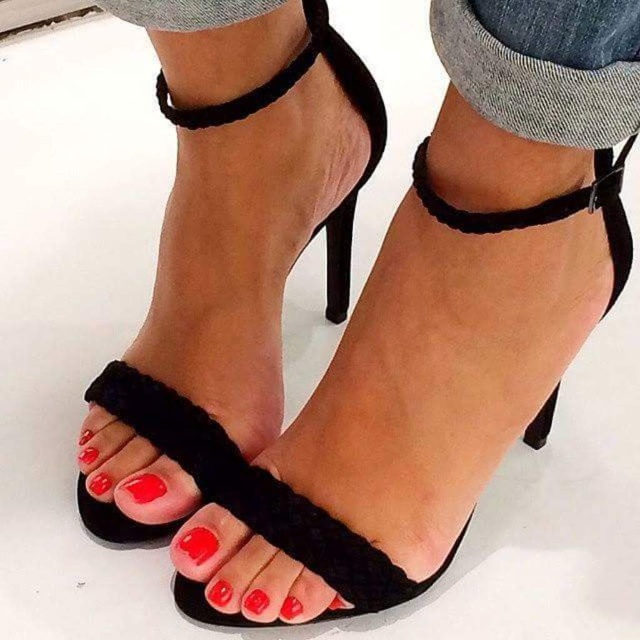
Question: Can you confirm if suede black sandal at center is positioned above matte black toe at center?

Choices:
 (A) no
 (B) yes

Answer: (B)

Question: Based on their relative distances, which object is nearer to the suede black sandal at center?

Choices:
 (A) velvet strap at center
 (B) matte black toe at center
 (C) glossy red nail polish at center

Answer: (C)

Question: Can you confirm if velvet strap at center is positioned above matte black toe at center?

Choices:
 (A) no
 (B) yes

Answer: (B)

Question: Which of these objects is positioned closest to the velvet strap at center?

Choices:
 (A) matte black toe at center
 (B) suede black sandal at center

Answer: (B)

Question: Where is velvet strap at center located in relation to glossy red nail polish at center in the image?

Choices:
 (A) below
 (B) above

Answer: (B)

Question: Which point appears closest to the camera in this image?

Choices:
 (A) (161, 502)
 (B) (593, 205)
 (C) (205, 534)
 (D) (273, 269)

Answer: (B)